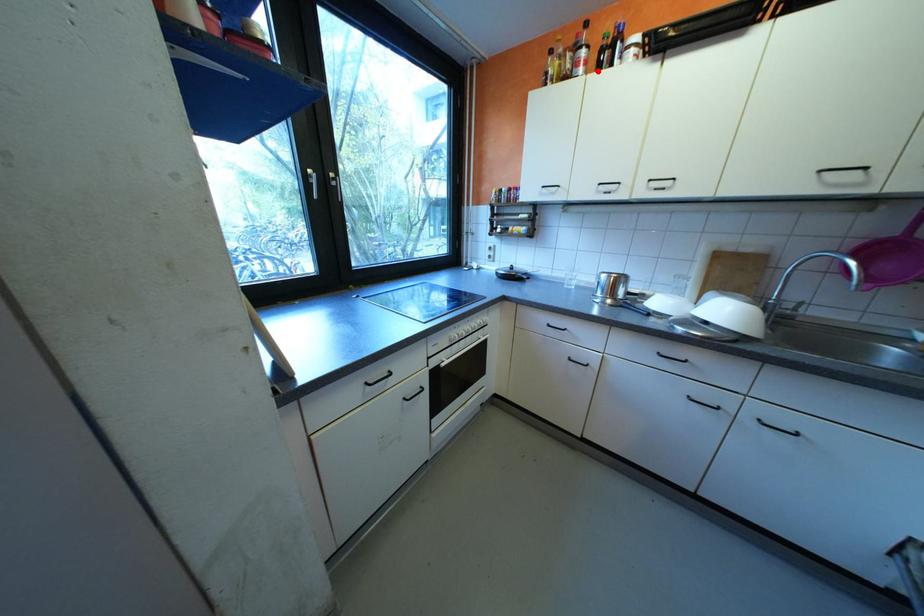
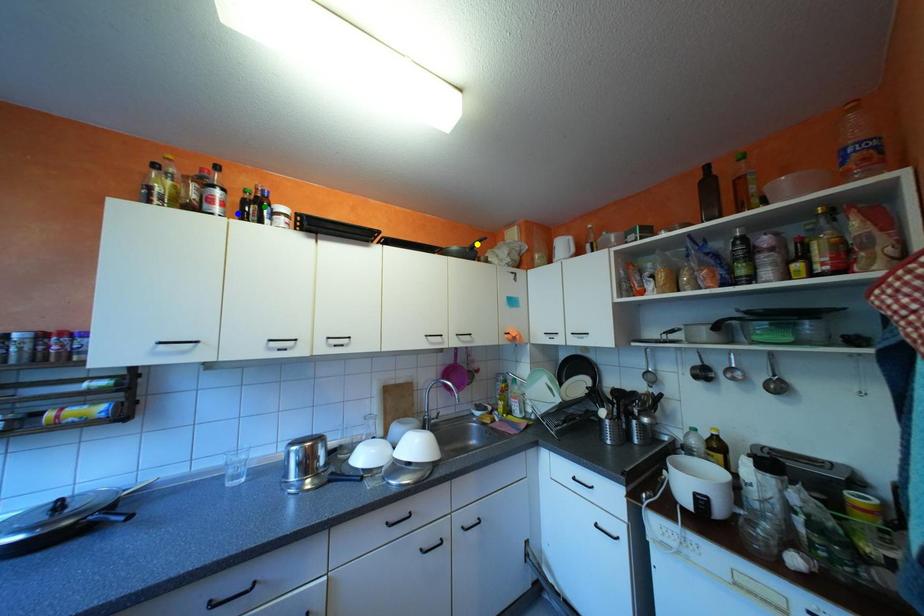
Question: I am providing you with two images of the same scene from different viewpoints. A red point is marked on the first image. You are given multiple points on the second image. Which point in image 2 represents the same 3d spot as the red point in image 1?

Choices:
 (A) blue point
 (B) yellow point
 (C) green point

Answer: (A)